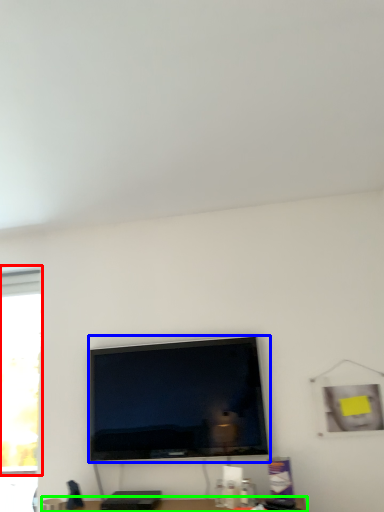
Question: Considering the real-world distances, which object is farthest from window (highlighted by a red box)? television (highlighted by a blue box) or furniture (highlighted by a green box)?

Choices:
 (A) television
 (B) furniture

Answer: (B)